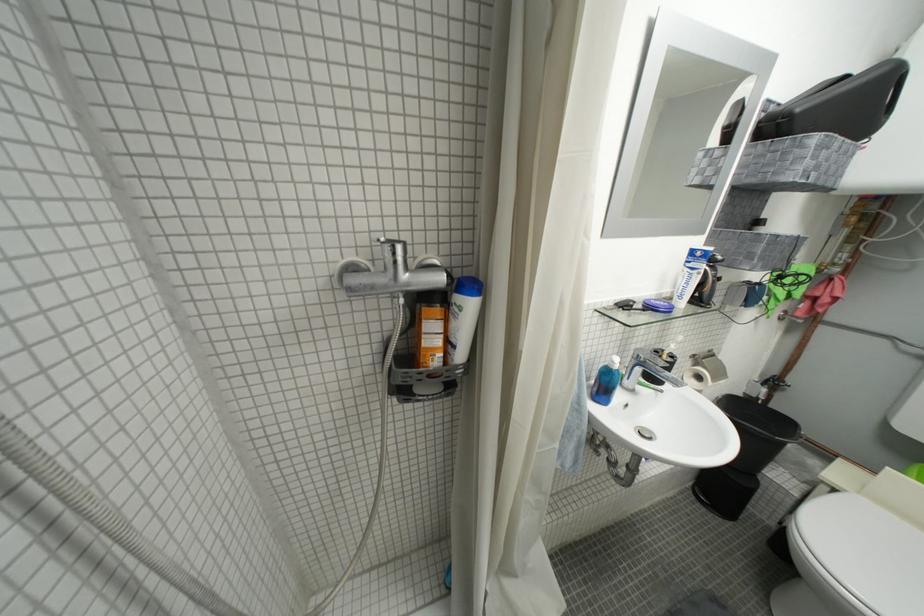
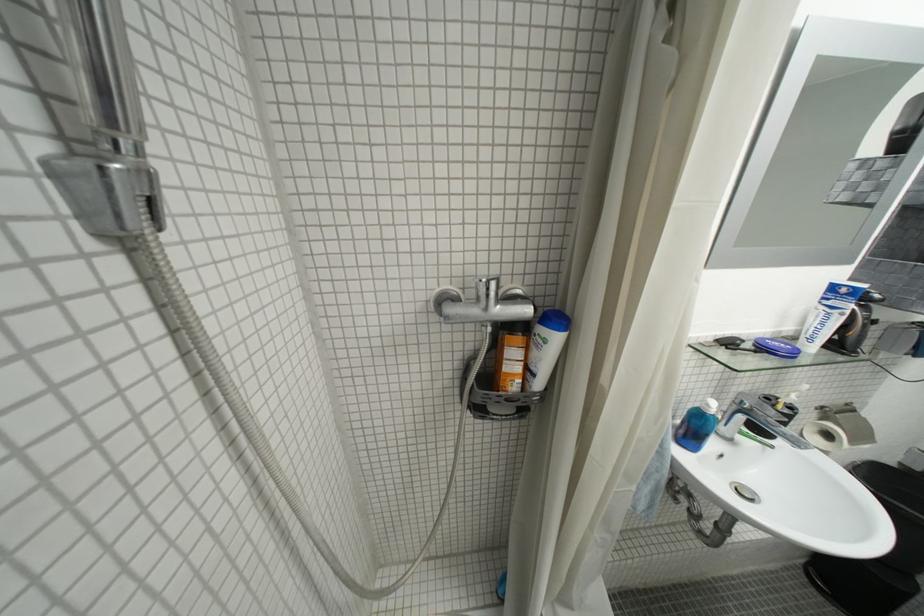
Locate, in the second image, the point that corresponds to [648,371] in the first image.

(749, 419)